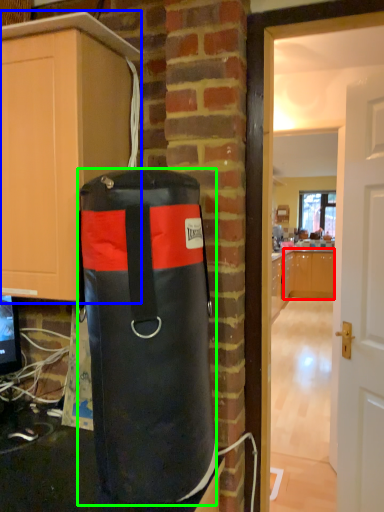
Question: Considering the real-world distances, which object is closest to cabinetry (highlighted by a red box)? cabinetry (highlighted by a blue box) or punching bag (highlighted by a green box).

Choices:
 (A) cabinetry
 (B) punching bag

Answer: (A)